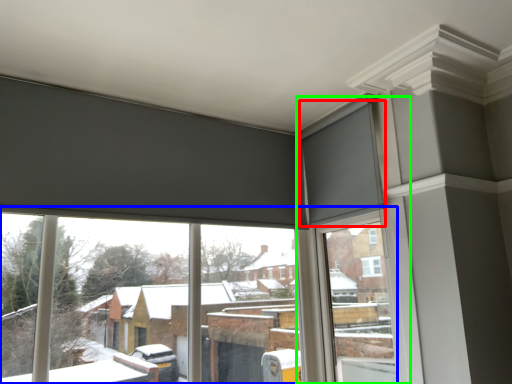
Question: Estimate the real-world distances between objects in this image. Which object is closer to curtain (highlighted by a red box), window (highlighted by a blue box) or window frame (highlighted by a green box)?

Choices:
 (A) window
 (B) window frame

Answer: (B)